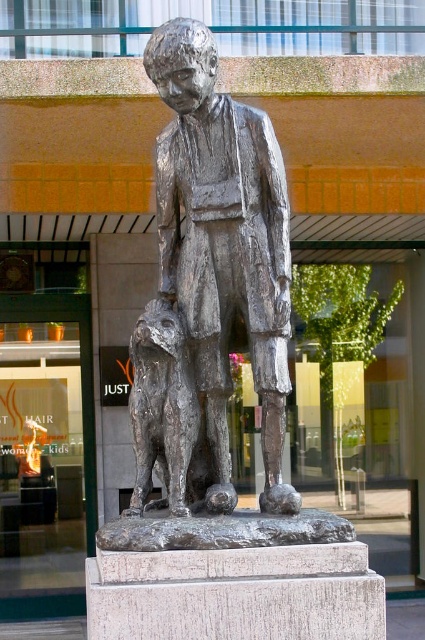
Question: Does polished silver statue at center have a lesser width compared to shiny bronze dog at center?

Choices:
 (A) yes
 (B) no

Answer: (B)

Question: Does polished silver statue at center have a larger size compared to shiny bronze dog at center?

Choices:
 (A) no
 (B) yes

Answer: (B)

Question: Among these objects, which one is farthest from the camera?

Choices:
 (A) shiny bronze dog at center
 (B) polished silver statue at center

Answer: (A)

Question: Which point appears farthest from the camera in this image?

Choices:
 (A) (172, 378)
 (B) (229, 163)

Answer: (B)

Question: Which object appears farthest from the camera in this image?

Choices:
 (A) polished silver statue at center
 (B) shiny bronze dog at center

Answer: (B)

Question: Can you confirm if polished silver statue at center is positioned to the left of shiny bronze dog at center?

Choices:
 (A) yes
 (B) no

Answer: (B)